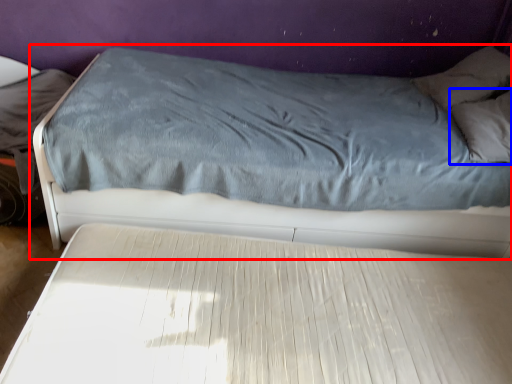
Question: Which object appears closest to the camera in this image, bed (highlighted by a red box) or pillow (highlighted by a blue box)?

Choices:
 (A) bed
 (B) pillow

Answer: (A)